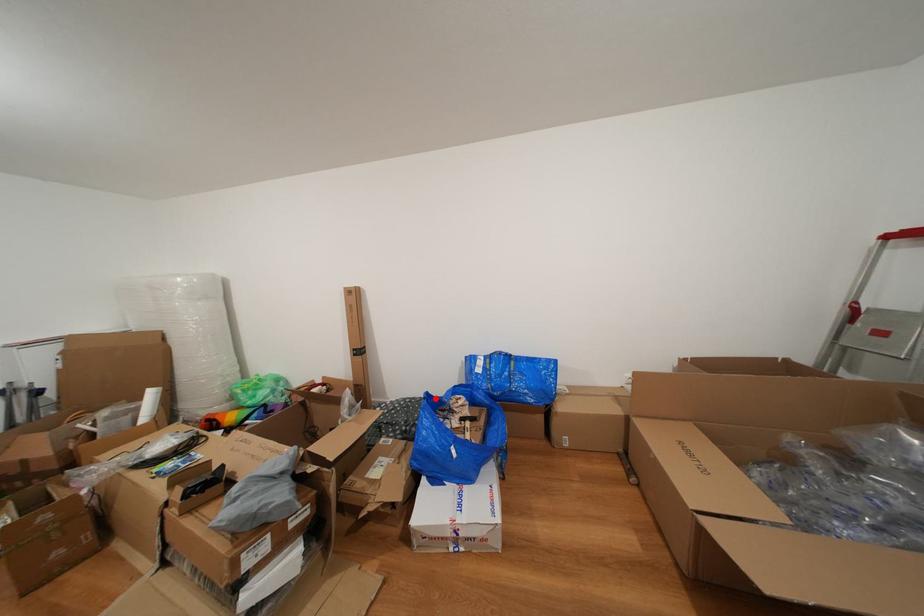
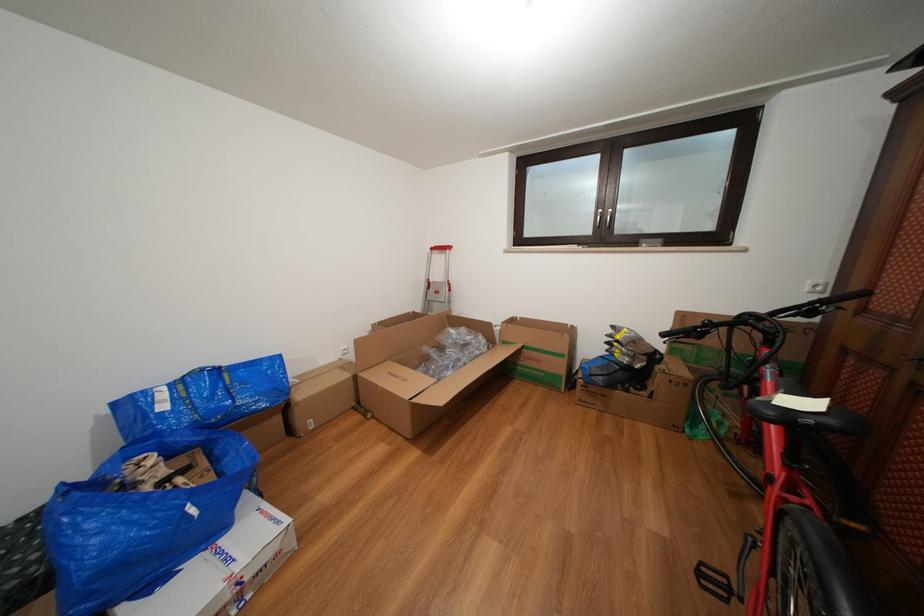
In the second image, find the point that corresponds to the highlighted location in the first image.

(71, 490)